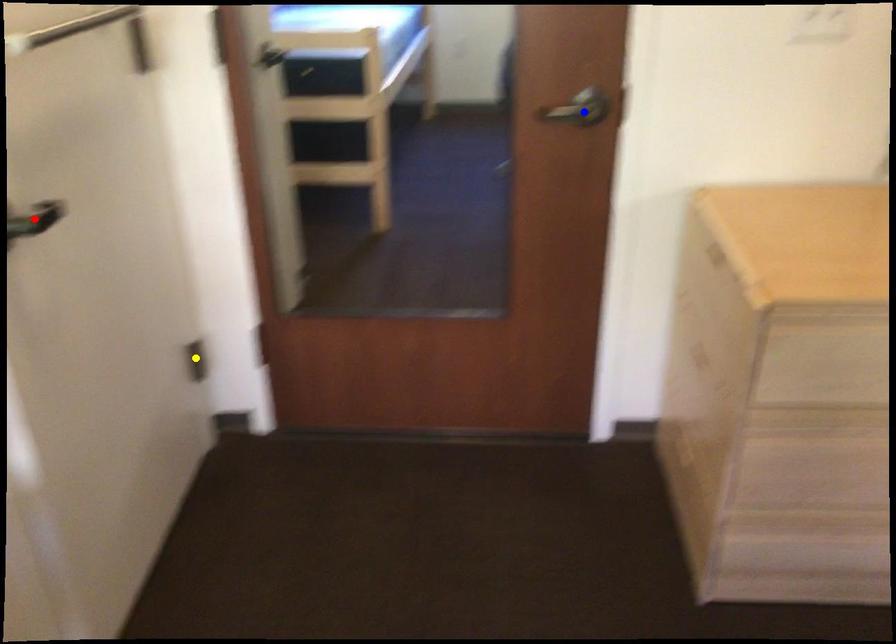
Order these from nearest to farthest:
1. yellow point
2. blue point
3. red point

1. red point
2. blue point
3. yellow point